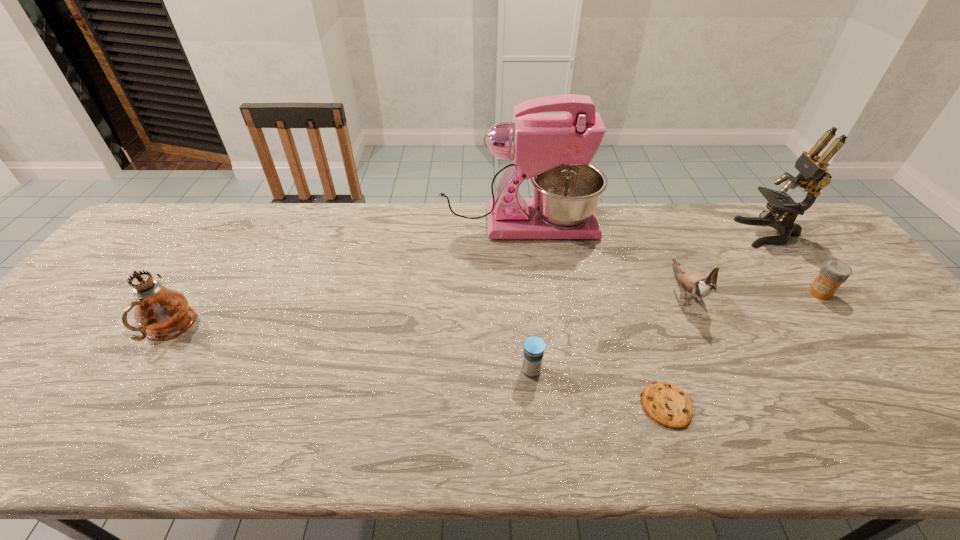
Identify the location of vacant space that is in between the tallest object and the farther medicine. (669, 259).

Locate an element on the screen. The height and width of the screenshot is (540, 960). unoccupied position between the right medicine and the mixer is located at coordinates (669, 259).

Where is `empty space that is in between the fourth shortest object and the farther medicine`? The height and width of the screenshot is (540, 960). empty space that is in between the fourth shortest object and the farther medicine is located at coordinates (753, 292).

At what (x,y) coordinates should I click in order to perform the action: click on object that is the third nearest to the second nearest object. Please return your answer as a coordinate pair (x, y). Looking at the image, I should click on (554, 150).

Identify the location of the closest object to the third object from right to left. (554, 150).

You are a GUI agent. You are given a task and a screenshot of the screen. Output one action in this format:
    pyautogui.click(x=<x>, y=<y>)
    Task: Click on the vacant space that satisfies the following two spatial constraints: 1. at the eyepieces of the microscope; 2. at the face of the fourth shortest object
    The height and width of the screenshot is (540, 960).
    Given the screenshot: What is the action you would take?
    pyautogui.click(x=814, y=291)

Locate an element on the screen. This screenshot has width=960, height=540. blank space that satisfies the following two spatial constraints: 1. on the front side of the sixth farthest object; 2. on the left side of the shortest object is located at coordinates (535, 406).

Identify the location of free space that satisfies the following two spatial constraints: 1. at the eyepieces of the microscope; 2. at the face of the fourth tallest object. click(814, 291).